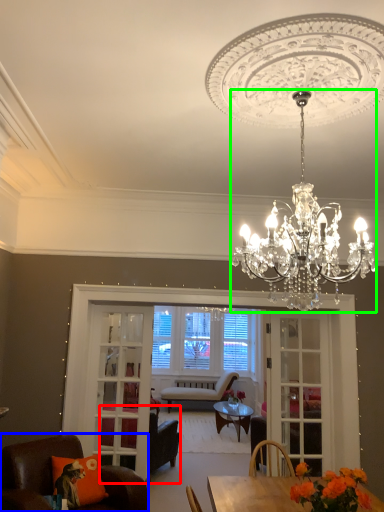
Question: Which object is the closest to the chair (highlighted by a red box)? Choose among these: chair (highlighted by a blue box) or chandelier (highlighted by a green box).

Choices:
 (A) chair
 (B) chandelier

Answer: (A)